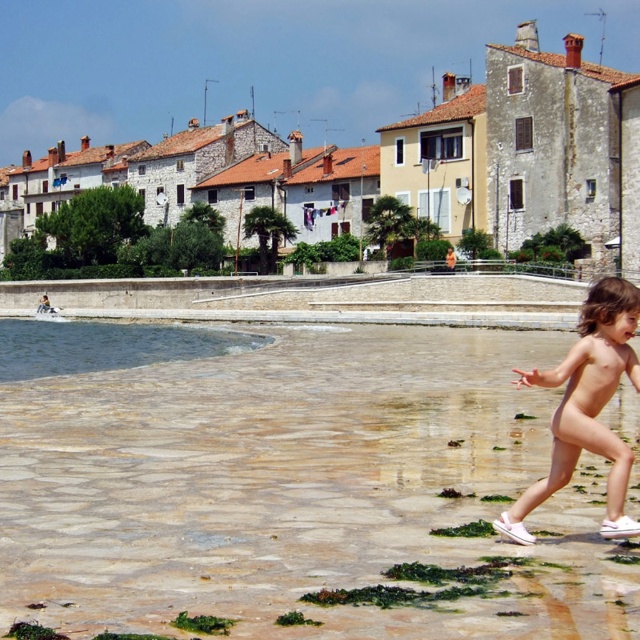
Is point (16, 493) positioned in front of point (596, 308)?

No, (16, 493) is behind (596, 308).

Does clear stone water at lower left appear on the right side of smooth skin child at lower right?

In fact, clear stone water at lower left is to the left of smooth skin child at lower right.

Find the location of a particular element. The image size is (640, 640). clear stone water at lower left is located at coordinates (301, 490).

Is point (316, 545) less distant than point (220, 353)?

Yes.

Does clear stone water at lower left appear over clear water at lower left?

Incorrect, clear stone water at lower left is not positioned above clear water at lower left.

Is point (314, 449) in front of point (51, 339)?

That is True.

Identify the location of clear stone water at lower left. The height and width of the screenshot is (640, 640). (301, 490).

Between smooth skin child at lower right and clear water at lower left, which one is positioned lower?

smooth skin child at lower right is below.

Describe the element at coordinates (586, 406) in the screenshot. The image size is (640, 640). I see `smooth skin child at lower right` at that location.

This screenshot has height=640, width=640. Identify the location of smooth skin child at lower right. (586, 406).